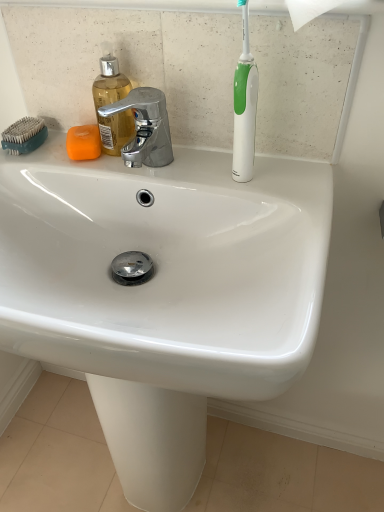
Find the location of a particular element. spots to the right of polished chrome faucet at upper center is located at coordinates (239, 182).